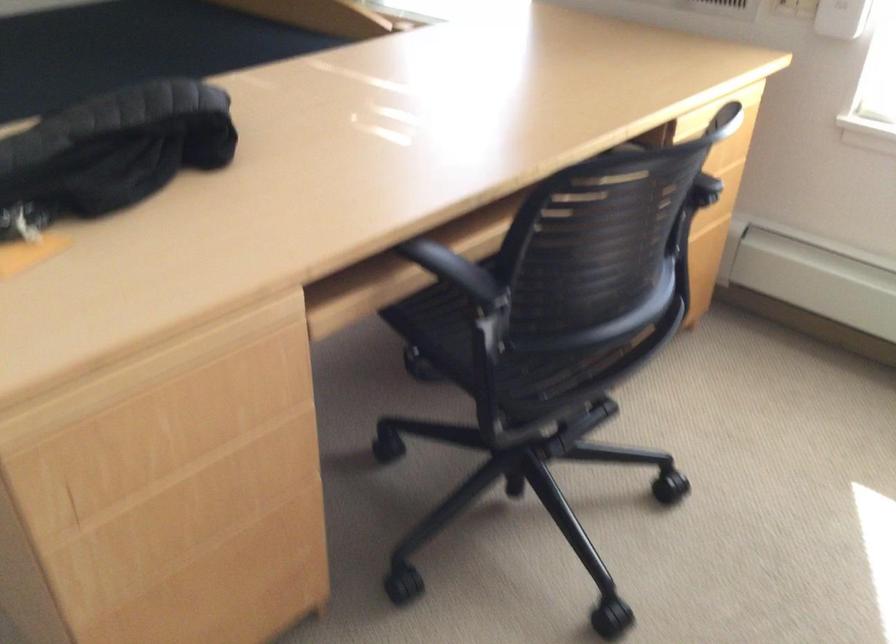
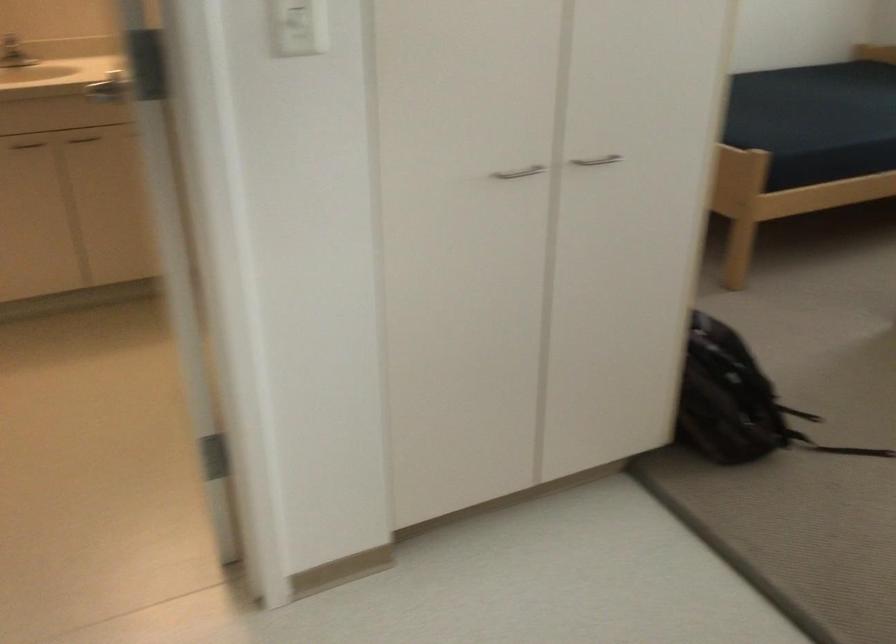
The images are taken continuously from a first-person perspective. In which direction are you moving?

The movement direction of the cameraman is left, backward.